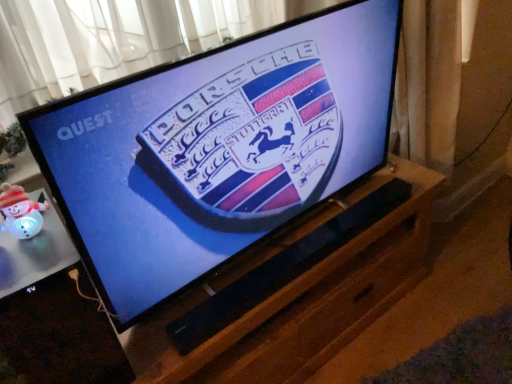
Identify the location of white glossy snowman at lower left. (52, 315).

Locate an element on the screen. The height and width of the screenshot is (384, 512). black matte speaker at center is located at coordinates (283, 268).

Is white glossy snowman at lower left to the right of black matte speaker at center from the viewer's perspective?

In fact, white glossy snowman at lower left is to the left of black matte speaker at center.

Is black matte speaker at center located within white glossy snowman at lower left?

No, black matte speaker at center is not inside white glossy snowman at lower left.

How far apart are white glossy snowman at lower left and black matte speaker at center?

A distance of 14.83 inches exists between white glossy snowman at lower left and black matte speaker at center.

Based on the photo, from a real-world perspective, which is physically above, white glossy snowman at lower left or black matte speaker at center?

white glossy snowman at lower left.

Looking at this image, in terms of width, does black matte speaker at center look wider or thinner when compared to white glossy snowman at lower left?

black matte speaker at center is thinner than white glossy snowman at lower left.

Does black matte speaker at center come behind white glossy snowman at lower left?

Yes, it is.

Is black matte speaker at center looking in the opposite direction of white glossy snowman at lower left?

No.

From the image's perspective, which one is positioned lower, black matte speaker at center or white glossy snowman at lower left?

From the image's view, white glossy snowman at lower left is below.

Is black matte speaker at center smaller than black glossy tv at center?

Correct, black matte speaker at center occupies less space than black glossy tv at center.

Do you think black matte speaker at center is within black glossy tv at center, or outside of it?

black matte speaker at center is outside black glossy tv at center.

Between point (206, 336) and point (154, 114), which one is positioned in front?

Positioned in front is point (154, 114).

Are black matte speaker at center and black glossy tv at center far apart?

No, there isn't a large distance between black matte speaker at center and black glossy tv at center.

Considering the sizes of black glossy tv at center and white glossy snowman at lower left in the image, is black glossy tv at center taller or shorter than white glossy snowman at lower left?

Clearly, black glossy tv at center is taller compared to white glossy snowman at lower left.

Between black glossy tv at center and white glossy snowman at lower left, which one is positioned behind?

black glossy tv at center.

Is white glossy snowman at lower left at the back of black glossy tv at center?

That's not correct — black glossy tv at center is not looking away from white glossy snowman at lower left.

Which point is more forward, (172, 270) or (12, 240)?

Point (12, 240)

Does white glossy snowman at lower left appear on the left side of black glossy tv at center?

Yes.

Looking at this image, considering the sizes of objects white glossy snowman at lower left and black glossy tv at center in the image provided, who is taller, white glossy snowman at lower left or black glossy tv at center?

black glossy tv at center is taller.

Does point (30, 368) lie in front of point (207, 200)?

Yes, it is.

From the picture: From a real-world perspective, is black glossy tv at center beneath black matte speaker at center?

No.

Consider the image. Is black glossy tv at center positioned in front of black matte speaker at center?

Yes, it is in front of black matte speaker at center.

Is black glossy tv at center situated inside black matte speaker at center or outside?

The correct answer is: outside.

From the image's perspective, is black glossy tv at center located beneath black matte speaker at center?

No.

The image size is (512, 384). In order to click on speaker lying on the right of white glossy snowman at lower left in this screenshot , I will do `click(283, 268)`.

I want to click on desktop lying in front of the black matte speaker at center, so click(52, 315).

When comparing their distances from black matte speaker at center, does black glossy tv at center or white glossy snowman at lower left seem closer?

black glossy tv at center.

Which object lies further to the anchor point black matte speaker at center, white glossy snowman at lower left or black glossy tv at center?

white glossy snowman at lower left is further to black matte speaker at center.

Which object lies nearer to the anchor point black glossy tv at center, black matte speaker at center or white glossy snowman at lower left?

black matte speaker at center is positioned closer to the anchor black glossy tv at center.

Looking at the image, which one is located further to black glossy tv at center, white glossy snowman at lower left or black matte speaker at center?

The object further to black glossy tv at center is white glossy snowman at lower left.

When comparing their distances from white glossy snowman at lower left, does black matte speaker at center or black glossy tv at center seem closer?

Among the two, black glossy tv at center is located nearer to white glossy snowman at lower left.

Considering their positions, is black glossy tv at center positioned closer to white glossy snowman at lower left than black matte speaker at center?

The object closer to white glossy snowman at lower left is black glossy tv at center.

Identify the location of television between white glossy snowman at lower left and black matte speaker at center in the horizontal direction. The width and height of the screenshot is (512, 384). (217, 148).